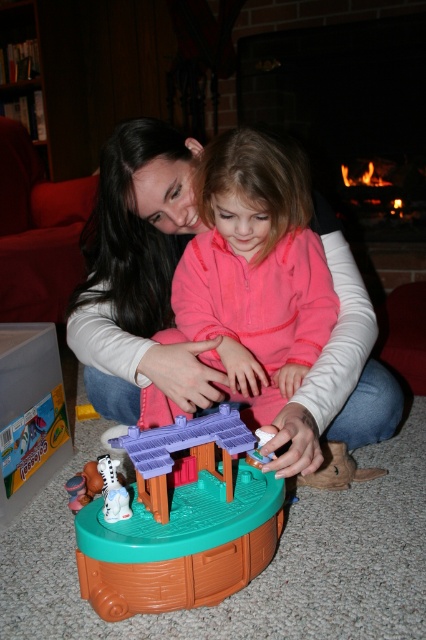
Question: Among these objects, which one is nearest to the camera?

Choices:
 (A) pink matte jacket at center
 (B) brick fireplace at upper center
 (C) white matte plush toy at lower left

Answer: (C)

Question: Which point is closer to the camera taking this photo?

Choices:
 (A) (425, 45)
 (B) (236, 490)

Answer: (B)

Question: Considering the relative positions of pink matte jacket at center and brown plastic playset at center in the image provided, where is pink matte jacket at center located with respect to brown plastic playset at center?

Choices:
 (A) left
 (B) right

Answer: (B)

Question: Is brick fireplace at upper center above brown plastic playset at center?

Choices:
 (A) yes
 (B) no

Answer: (A)

Question: Can you confirm if pink matte jacket at center is thinner than brown plastic playset at center?

Choices:
 (A) no
 (B) yes

Answer: (A)

Question: Which object is closer to the camera taking this photo?

Choices:
 (A) pink matte jacket at center
 (B) white matte plush toy at lower left
 (C) brick fireplace at upper center

Answer: (B)